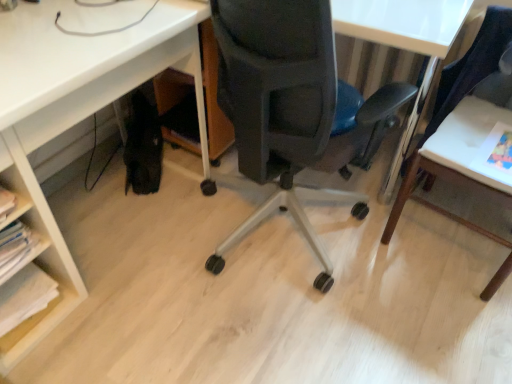
Question: Does matte black chair at center appear on the left side of white paper at lower left?

Choices:
 (A) yes
 (B) no

Answer: (B)

Question: From a real-world perspective, is matte black chair at center physically above white paper at lower left?

Choices:
 (A) yes
 (B) no

Answer: (A)

Question: From the image's perspective, is matte black chair at center above white paper at lower left?

Choices:
 (A) yes
 (B) no

Answer: (A)

Question: Can white paper at lower left be found inside matte black chair at center?

Choices:
 (A) no
 (B) yes

Answer: (A)

Question: Is matte black chair at center positioned beyond the bounds of white paper at lower left?

Choices:
 (A) yes
 (B) no

Answer: (A)

Question: Considering the positions of white wood table at right and white matte desk at lower left in the image, is white wood table at right bigger or smaller than white matte desk at lower left?

Choices:
 (A) big
 (B) small

Answer: (B)

Question: Would you say white wood table at right is to the left or to the right of white matte desk at lower left in the picture?

Choices:
 (A) right
 (B) left

Answer: (A)

Question: From the image's perspective, is white wood table at right located above or below white matte desk at lower left?

Choices:
 (A) above
 (B) below

Answer: (B)

Question: Does point (465, 173) appear closer or farther from the camera than point (118, 39)?

Choices:
 (A) farther
 (B) closer

Answer: (A)

Question: From a real-world perspective, is white paper at lower left physically located above or below white matte desk at lower left?

Choices:
 (A) above
 (B) below

Answer: (B)

Question: From the image's perspective, relative to white matte desk at lower left, is white paper at lower left above or below?

Choices:
 (A) below
 (B) above

Answer: (A)

Question: Is white paper at lower left wider or thinner than white matte desk at lower left?

Choices:
 (A) wide
 (B) thin

Answer: (B)

Question: Is white paper at lower left taller or shorter than white matte desk at lower left?

Choices:
 (A) short
 (B) tall

Answer: (A)

Question: From a real-world perspective, is white matte desk at lower left above or below white wood table at right?

Choices:
 (A) above
 (B) below

Answer: (B)

Question: Looking at the image, does white matte desk at lower left seem bigger or smaller compared to white wood table at right?

Choices:
 (A) big
 (B) small

Answer: (A)